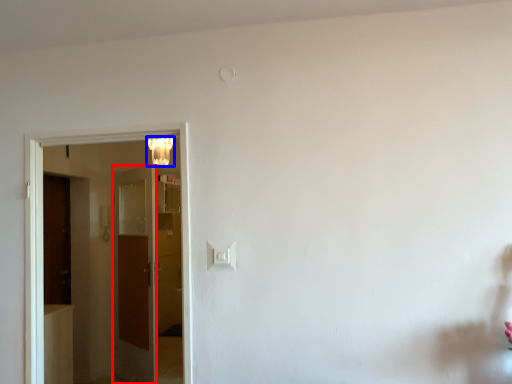
Question: Which object is closer to the camera taking this photo, door (highlighted by a red box) or lamp (highlighted by a blue box)?

Choices:
 (A) door
 (B) lamp

Answer: (B)